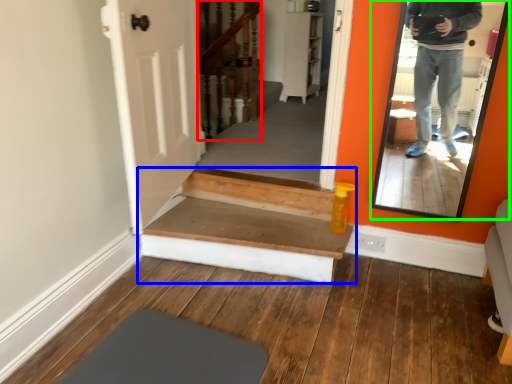
Question: Considering the real-world distances, which object is closest to stairwell (highlighted by a red box)? stairs (highlighted by a blue box) or mirror (highlighted by a green box).

Choices:
 (A) stairs
 (B) mirror

Answer: (A)